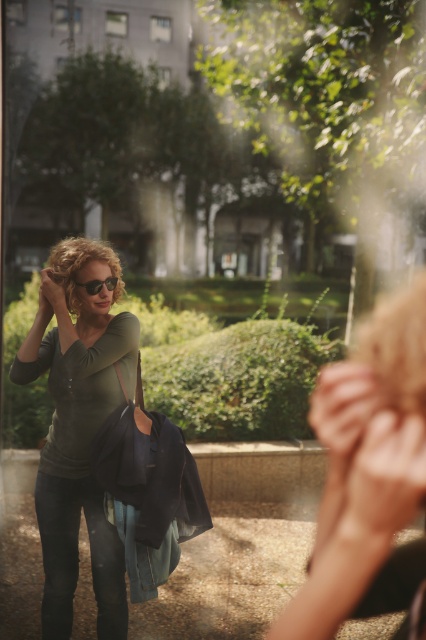
Which is more to the left, smooth beige handbag at lower right or matte black sunglasses at center?

matte black sunglasses at center is more to the left.

Locate an element on the screen. The width and height of the screenshot is (426, 640). smooth beige handbag at lower right is located at coordinates (368, 477).

Is point (89, 388) positioned before point (86, 285)?

Yes, point (89, 388) is closer to viewer.

Is matte green shirt at center to the right of matte black sunglasses at center from the viewer's perspective?

Incorrect, matte green shirt at center is not on the right side of matte black sunglasses at center.

Which is behind, point (104, 246) or point (114, 285)?

The point (114, 285) is more distant.

Identify the location of matte green shirt at center. The height and width of the screenshot is (640, 426). (77, 428).

Which is behind, point (342, 428) or point (58, 336)?

The point (58, 336) is behind.

Can you confirm if smooth beige handbag at lower right is positioned to the left of matte green shirt at center?

In fact, smooth beige handbag at lower right is to the right of matte green shirt at center.

Is point (322, 515) positioned in front of point (63, 284)?

That is True.

This screenshot has height=640, width=426. What are the coordinates of `smooth beige handbag at lower right` in the screenshot? It's located at (368, 477).